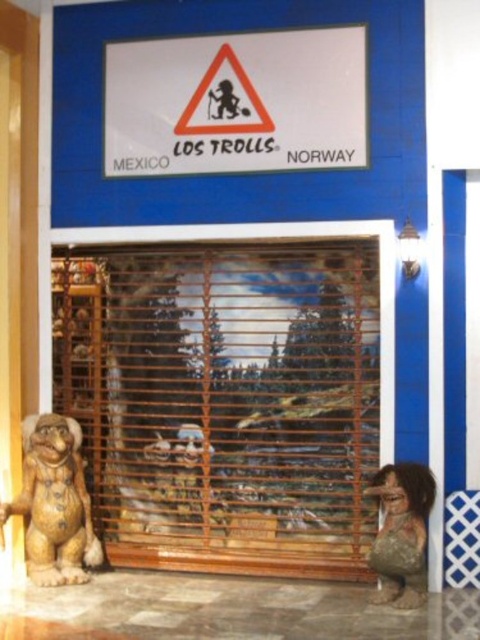
Who is positioned more to the right, brown wooden figurine at lower left or matte brown statue at lower right?

Positioned to the right is matte brown statue at lower right.

Does brown wooden figurine at lower left have a lesser height compared to matte brown statue at lower right?

No.

Does point (68, 432) lie in front of point (382, 586)?

No, (68, 432) is behind (382, 586).

The height and width of the screenshot is (640, 480). Find the location of `brown wooden figurine at lower left`. brown wooden figurine at lower left is located at coordinates (55, 502).

Is point (323, 136) less distant than point (403, 577)?

No, (323, 136) is behind (403, 577).

Who is shorter, white paper sign at upper center or matte brown statue at lower right?

With less height is matte brown statue at lower right.

Which is behind, point (264, 170) or point (384, 545)?

The point (264, 170) is more distant.

I want to click on white paper sign at upper center, so click(237, 102).

Find the location of a particular element. white paper sign at upper center is located at coordinates (237, 102).

Does point (204, 42) lie in front of point (85, 515)?

No, it is behind (85, 515).

Locate an element on the screen. white paper sign at upper center is located at coordinates [x=237, y=102].

What are the coordinates of `white paper sign at upper center` in the screenshot? It's located at (237, 102).